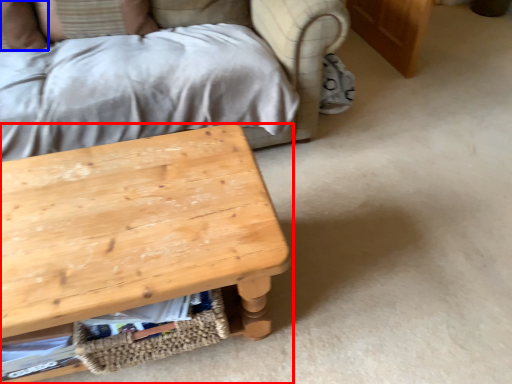
Question: Which point is closer to the camera, table (highlighted by a red box) or pillow (highlighted by a blue box)?

Choices:
 (A) table
 (B) pillow

Answer: (A)